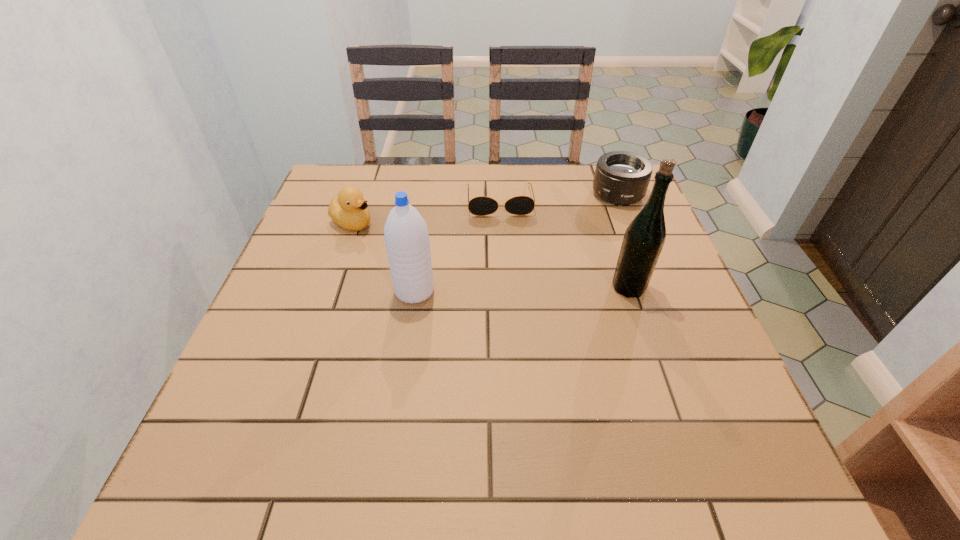
Locate an element on the screen. This screenshot has height=540, width=960. vacant spot on the desktop that is between the fourth shortest object and the tallest object and is positioned on the front-facing side of the sunglasses is located at coordinates (509, 289).

Where is `free space on the desktop that is between the fourth object from right to left and the tallest object and is positioned on the side of the telephoto lens with brand markings and control switches`? Image resolution: width=960 pixels, height=540 pixels. free space on the desktop that is between the fourth object from right to left and the tallest object and is positioned on the side of the telephoto lens with brand markings and control switches is located at coordinates (536, 289).

You are a GUI agent. You are given a task and a screenshot of the screen. Output one action in this format:
    pyautogui.click(x=<x>, y=<y>)
    Task: Click on the free space on the desktop that is between the fourth shortest object and the tallest object and is positioned on the face of the leftmost object
    The image size is (960, 540).
    Given the screenshot: What is the action you would take?
    pyautogui.click(x=497, y=290)